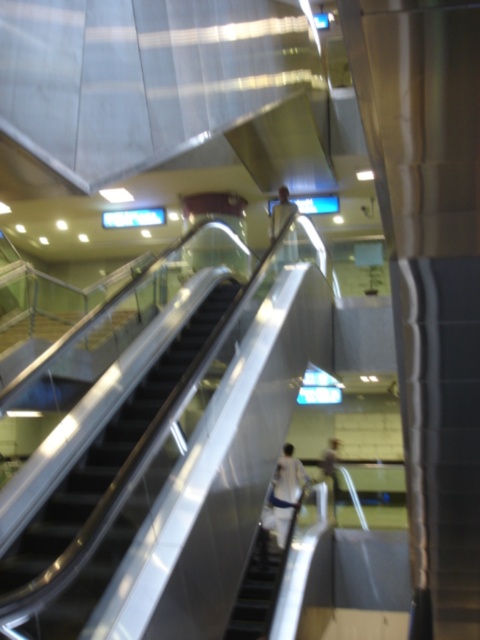
Question: Which of these objects is positioned farthest from the white fabric at center?

Choices:
 (A) metallic escalator at center
 (B) light brown leather jacket at center

Answer: (B)

Question: Does white fabric at center come in front of light brown leather jacket at center?

Choices:
 (A) yes
 (B) no

Answer: (A)

Question: Which object is the closest to the white fabric at center?

Choices:
 (A) metallic escalator at center
 (B) light brown leather jacket at center

Answer: (A)

Question: Among these points, which one is farthest from the camera?

Choices:
 (A) (334, 464)
 (B) (294, 488)

Answer: (A)

Question: Does metallic escalator at center appear on the left side of light brown leather jacket at center?

Choices:
 (A) no
 (B) yes

Answer: (B)

Question: Does white fabric at center appear under light brown leather jacket at center?

Choices:
 (A) yes
 (B) no

Answer: (B)